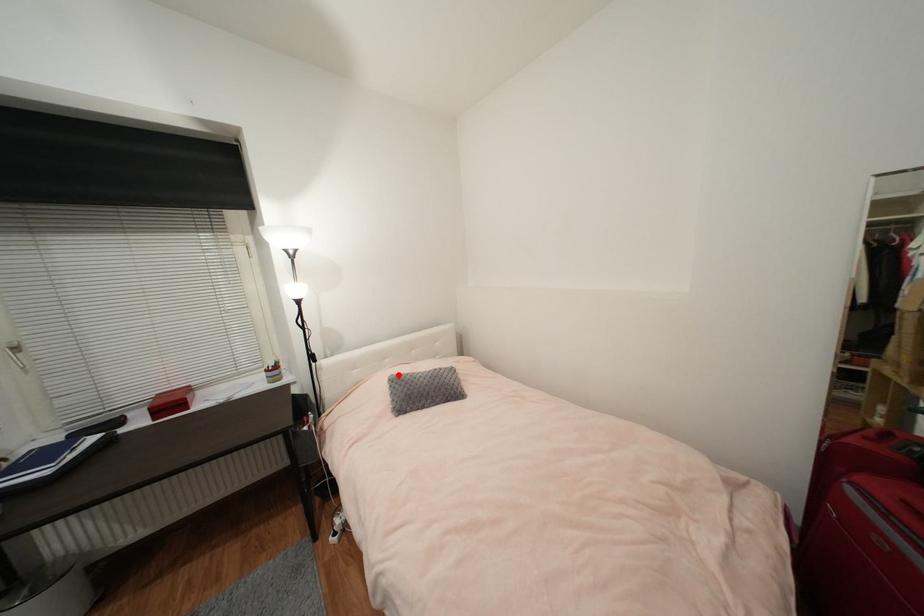
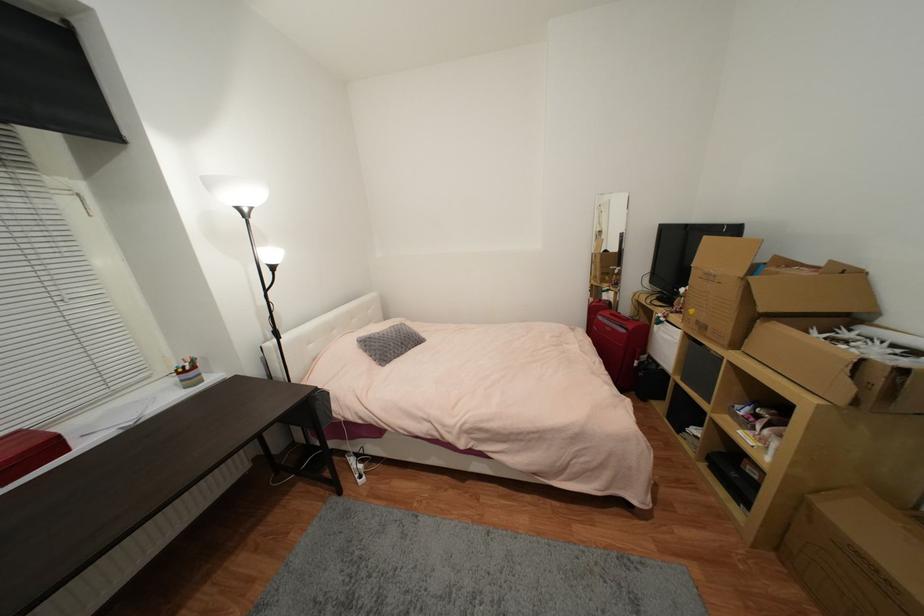
Where in the second image is the point corresponding to the highlighted location from the first image?

(365, 338)